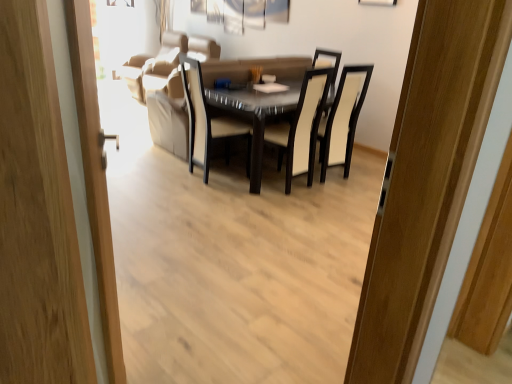
Where is `free space on the front side of black leather chair at center, arranged as the 2th chair when viewed from the left`? free space on the front side of black leather chair at center, arranged as the 2th chair when viewed from the left is located at coordinates (341, 198).